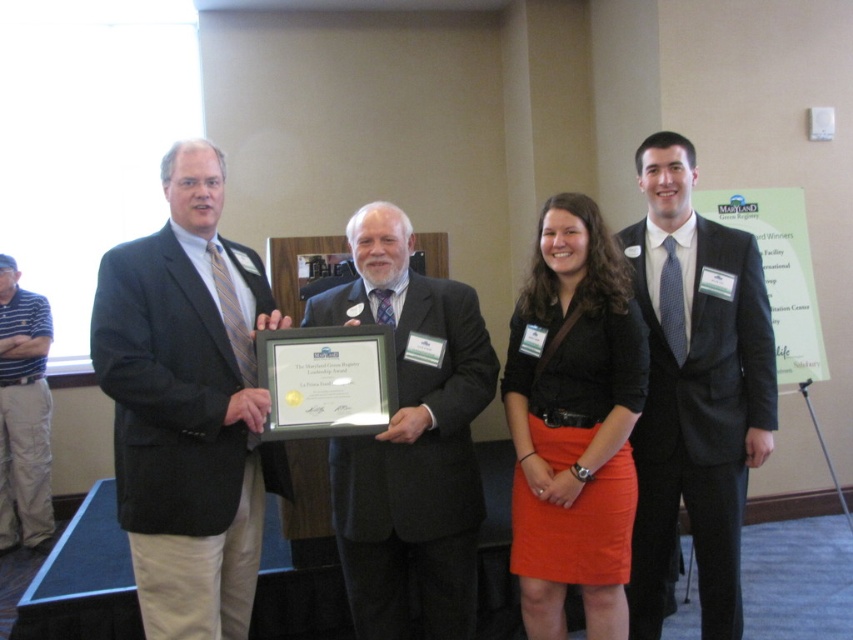
You are attending a formal event and notice two attendees wearing the matte black suit at center and the orange matte skirt at center. Which of these two items is taller?

The matte black suit at center is taller than the orange matte skirt at center.

You are attending a formal event and want to greet the person in the orange matte skirt at center. Which direction should you move from the dark gray suit at right to reach them?

To reach the orange matte skirt at center from the dark gray suit at right, you should move to the left, as the dark gray suit at right is positioned to the right of the orange matte skirt at center.

You are attending a formal event and notice two attendees wearing different clothing items. The dark gray suit at right and the striped cotton polo shirt at left. Based on their positions, which clothing item is higher up in the image?

The dark gray suit at right is located above the striped cotton polo shirt at left, so the dark gray suit at right is higher up in the image.